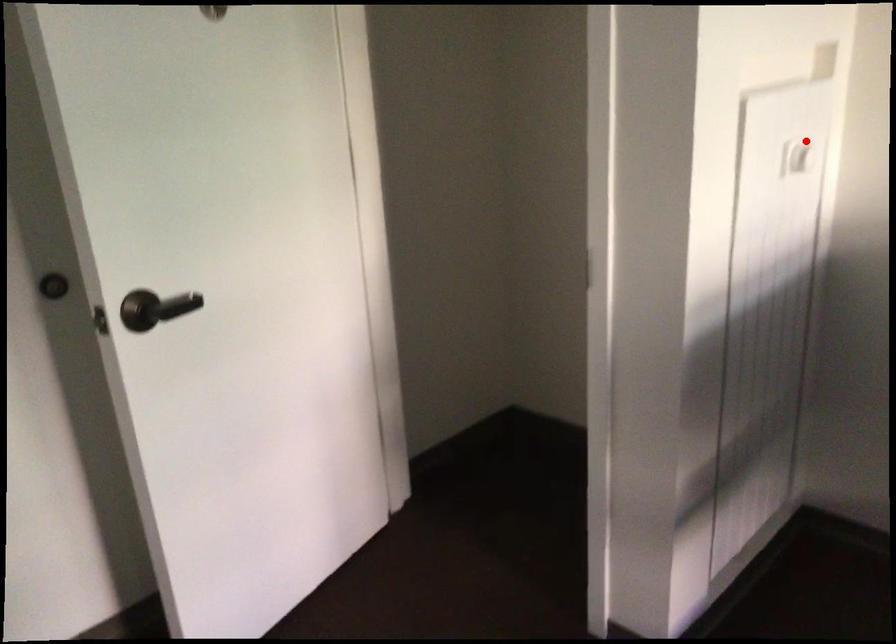
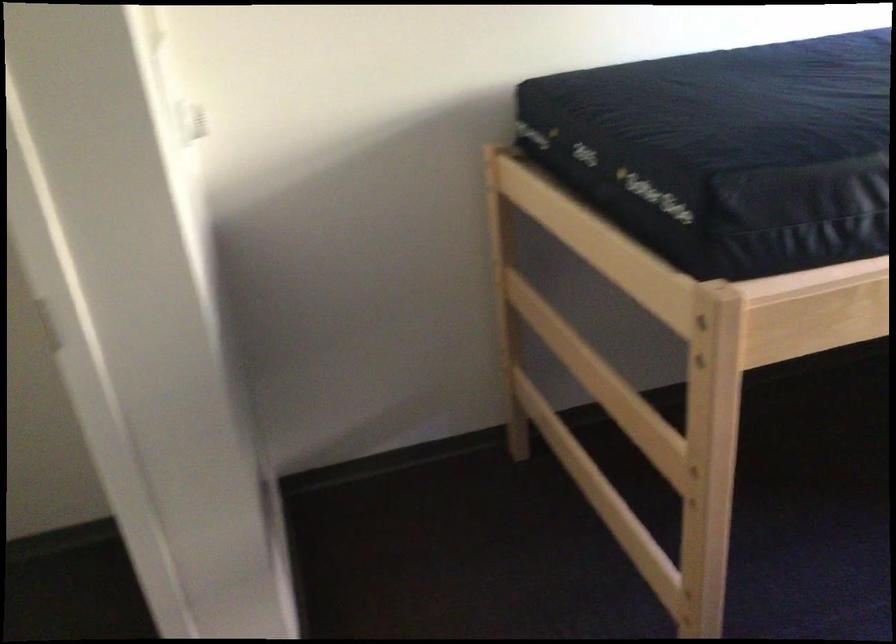
Question: A red point is marked in image1. In image2, is the corresponding 3D point closer to the camera or farther? Reply with the corresponding letter.

Choices:
 (A) The corresponding 3D point is closer.
 (B) The corresponding 3D point is farther.

Answer: (A)